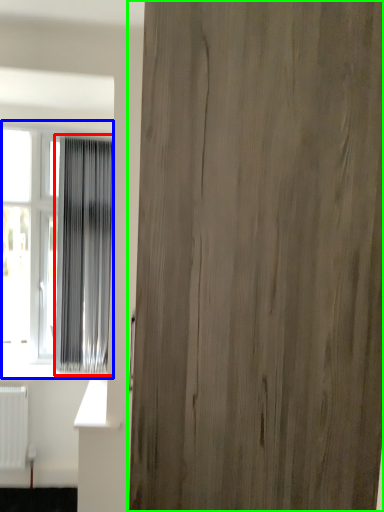
Question: Which object is positioned closest to curtain (highlighted by a red box)? Select from window (highlighted by a blue box) and door (highlighted by a green box).

Choices:
 (A) window
 (B) door

Answer: (A)